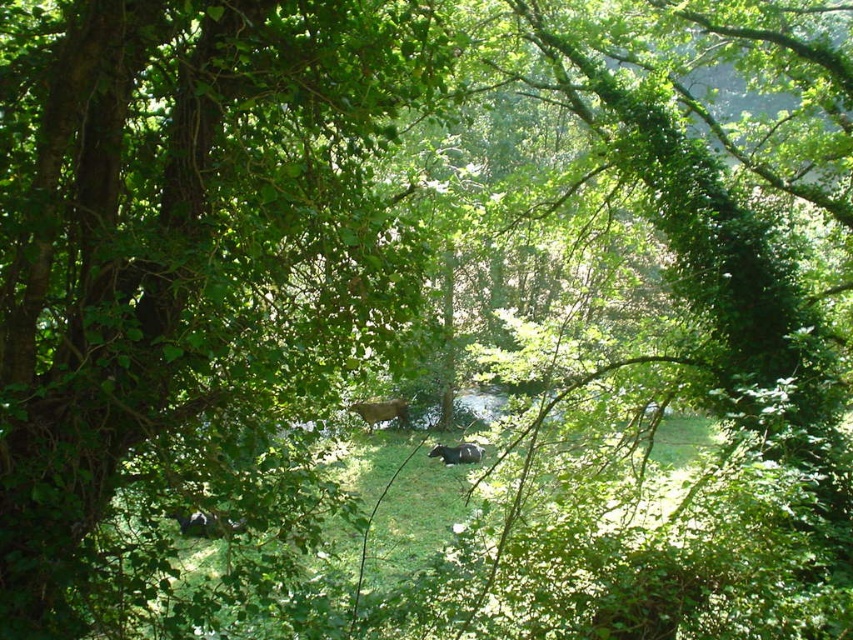
Who is lower down, brown fur cow at center or shiny black bear at center?

shiny black bear at center is below.

Locate an element on the screen. brown fur cow at center is located at coordinates (381, 412).

Identify the location of brown fur cow at center. The image size is (853, 640). (381, 412).

Between point (207, 346) and point (357, 412), which one is positioned behind?

Point (357, 412)

Can you confirm if green leafy tree at center is wider than brown fur cow at center?

Yes, green leafy tree at center is wider than brown fur cow at center.

Does point (184, 420) come behind point (404, 412)?

No, it is not.

The image size is (853, 640). In order to click on green leafy tree at center in this screenshot , I will do `click(189, 273)`.

Can you confirm if green leafy tree at center is bigger than shiny black bear at center?

Yes.

Measure the distance between point (113, 81) and camera.

They are 3.78 meters apart.

This screenshot has width=853, height=640. I want to click on green leafy tree at center, so click(189, 273).